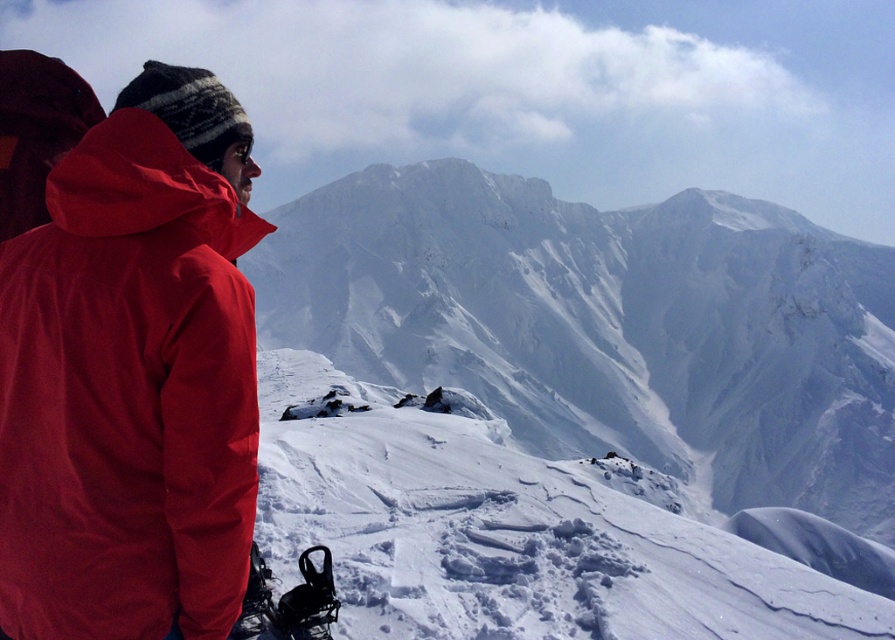
Is white snow-covered mountain at center smaller than white powdery snow at center?

Actually, white snow-covered mountain at center might be larger than white powdery snow at center.

Does white snow-covered mountain at center come in front of white powdery snow at center?

No, it is behind white powdery snow at center.

Between point (265, 333) and point (286, 406), which one is positioned behind?

The point (265, 333) is behind.

This screenshot has height=640, width=895. I want to click on white snow-covered mountain at center, so click(x=608, y=324).

Can you confirm if matte red jacket at left is smaller than white powdery snow at center?

Correct, matte red jacket at left occupies less space than white powdery snow at center.

Is matte red jacket at left shorter than white powdery snow at center?

Yes, matte red jacket at left is shorter than white powdery snow at center.

Is point (33, 316) closer to viewer compared to point (420, 596)?

Yes.

The image size is (895, 640). I want to click on matte red jacket at left, so click(126, 396).

Which is behind, point (597, 260) or point (72, 604)?

The point (597, 260) is more distant.

Is white snow-covered mountain at center below matte red jacket at left?

No.

Find the location of a particular element. Image resolution: width=895 pixels, height=640 pixels. white snow-covered mountain at center is located at coordinates (608, 324).

The image size is (895, 640). Identify the location of white snow-covered mountain at center. (608, 324).